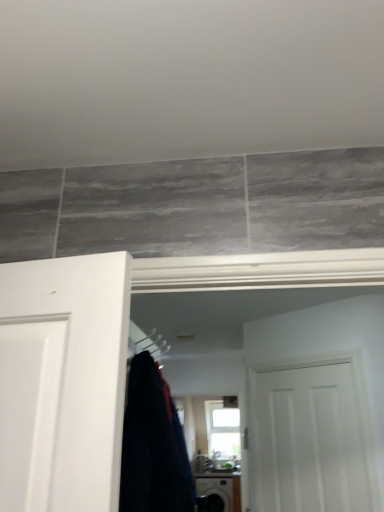
Find the location of a particular element. clear glass window at center is located at coordinates (222, 429).

This screenshot has height=512, width=384. What do you see at coordinates (317, 407) in the screenshot? I see `white matte door at center` at bounding box center [317, 407].

What do you see at coordinates (216, 493) in the screenshot?
I see `black glossy washing machine at lower center` at bounding box center [216, 493].

Image resolution: width=384 pixels, height=512 pixels. In order to click on silver metallic hanger at center in this screenshot , I will do `click(146, 343)`.

You are a GUI agent. You are given a task and a screenshot of the screen. Output one action in this format:
    pyautogui.click(x=<x>, y=<y>)
    Task: Click on the clear glass window at center
    
    Given the screenshot: What is the action you would take?
    pyautogui.click(x=222, y=429)

Does black glossy washing machine at lower center have a greater width compared to white matte door at center?

Indeed, black glossy washing machine at lower center has a greater width compared to white matte door at center.

From a real-world perspective, is black glossy washing machine at lower center on top of white matte door at center?

No, from a real-world perspective, black glossy washing machine at lower center is not above white matte door at center.

Based on their positions, is black glossy washing machine at lower center located to the left or right of white matte door at center?

Clearly, black glossy washing machine at lower center is on the left of white matte door at center in the image.

Is dark blue fabric at center not close to white matte door at center?

Absolutely, dark blue fabric at center is distant from white matte door at center.

Consider the image. From a real-world perspective, which object stands above the other?

In real-world perspective, dark blue fabric at center is above.

Is dark blue fabric at center spatially inside white matte door at center, or outside of it?

dark blue fabric at center is located beyond the bounds of white matte door at center.

Can you tell me how much dark blue fabric at center and white matte door at center differ in facing direction?

136 degrees.

Is black glossy washing machine at lower center facing towards dark blue fabric at center?

Yes, black glossy washing machine at lower center is oriented towards dark blue fabric at center.

Looking at this image, do you think black glossy washing machine at lower center is within dark blue fabric at center, or outside of it?

black glossy washing machine at lower center is outside dark blue fabric at center.

From the image's perspective, which one is positioned higher, black glossy washing machine at lower center or dark blue fabric at center?

dark blue fabric at center.

Would you say black glossy washing machine at lower center is a long distance from dark blue fabric at center?

black glossy washing machine at lower center is far away from dark blue fabric at center.

Is dark blue fabric at center bigger or smaller than black glossy washing machine at lower center?

Considering their sizes, dark blue fabric at center takes up less space than black glossy washing machine at lower center.

What's the angular difference between dark blue fabric at center and black glossy washing machine at lower center's facing directions?

90.4 degrees separate the facing orientations of dark blue fabric at center and black glossy washing machine at lower center.

Is dark blue fabric at center located outside black glossy washing machine at lower center?

dark blue fabric at center lies outside black glossy washing machine at lower center's area.

Find the location of `appliance below the dark blue fabric at center (from a real-world perspective)`. appliance below the dark blue fabric at center (from a real-world perspective) is located at coordinates (216, 493).

Is white matte door at center looking in the opposite direction of dark blue fabric at center?

white matte door at center is not turned away from dark blue fabric at center.

Who is taller, white matte door at center or dark blue fabric at center?

white matte door at center.

Based on the photo, considering the relative positions of white matte door at center and dark blue fabric at center in the image provided, is white matte door at center to the left or to the right of dark blue fabric at center?

In the image, white matte door at center appears on the right side of dark blue fabric at center.

From the image's perspective, is white matte door at center over clear glass window at center?

Indeed, from the image's perspective, white matte door at center is shown above clear glass window at center.

Is white matte door at center located outside clear glass window at center?

white matte door at center lies outside clear glass window at center's area.

Looking at this image, considering the sizes of objects white matte door at center and clear glass window at center in the image provided, who is thinner, white matte door at center or clear glass window at center?

white matte door at center is thinner.

Identify the location of window behind the white matte door at center. This screenshot has height=512, width=384. (x=222, y=429).

Can you confirm if clear glass window at center is shorter than dark blue fabric at center?

In fact, clear glass window at center may be taller than dark blue fabric at center.

Is point (216, 426) closer to viewer compared to point (132, 509)?

No, it is behind (132, 509).

Is clear glass window at center facing away from dark blue fabric at center?

That's not correct — clear glass window at center is not looking away from dark blue fabric at center.

This screenshot has height=512, width=384. What are the coordinates of `appliance to the left of white matte door at center` in the screenshot? It's located at (216, 493).

Locate an element on the screen. This screenshot has height=512, width=384. clothing located above the white matte door at center (from the image's perspective) is located at coordinates (153, 446).

When comparing their distances from silver metallic hanger at center, does dark blue fabric at center or clear glass window at center seem closer?

clear glass window at center.

Which object lies nearer to the anchor point clear glass window at center, black glossy washing machine at lower center or dark blue fabric at center?

black glossy washing machine at lower center is positioned closer to the anchor clear glass window at center.

From the image, which object appears to be farther from silver metallic hanger at center, clear glass window at center or white matte door at center?

clear glass window at center is further to silver metallic hanger at center.

Based on their spatial positions, is white matte door at center or clear glass window at center further from black glossy washing machine at lower center?

Based on the image, white matte door at center appears to be further to black glossy washing machine at lower center.

Considering their positions, is black glossy washing machine at lower center positioned further to dark blue fabric at center than clear glass window at center?

clear glass window at center is positioned further to the anchor dark blue fabric at center.

In the scene shown: Considering their positions, is silver metallic hanger at center positioned further to dark blue fabric at center than clear glass window at center?

Based on the image, clear glass window at center appears to be further to dark blue fabric at center.

Which object lies nearer to the anchor point silver metallic hanger at center, dark blue fabric at center or black glossy washing machine at lower center?

Among the two, black glossy washing machine at lower center is located nearer to silver metallic hanger at center.

From the image, which object appears to be farther from white matte door at center, silver metallic hanger at center or clear glass window at center?

Based on the image, clear glass window at center appears to be further to white matte door at center.

The image size is (384, 512). Identify the location of appliance between white matte door at center and clear glass window at center from front to back. (216, 493).

The image size is (384, 512). In order to click on hanger between dark blue fabric at center and white matte door at center from front to back in this screenshot , I will do `click(146, 343)`.

This screenshot has height=512, width=384. In order to click on appliance between dark blue fabric at center and clear glass window at center along the z-axis in this screenshot , I will do `click(216, 493)`.

Identify the location of appliance positioned between silver metallic hanger at center and clear glass window at center from near to far. (216, 493).